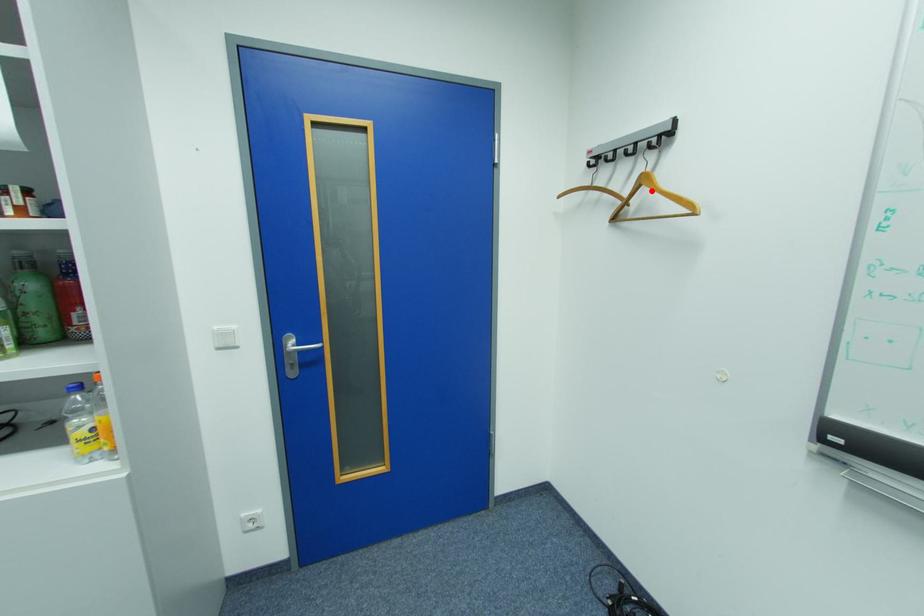
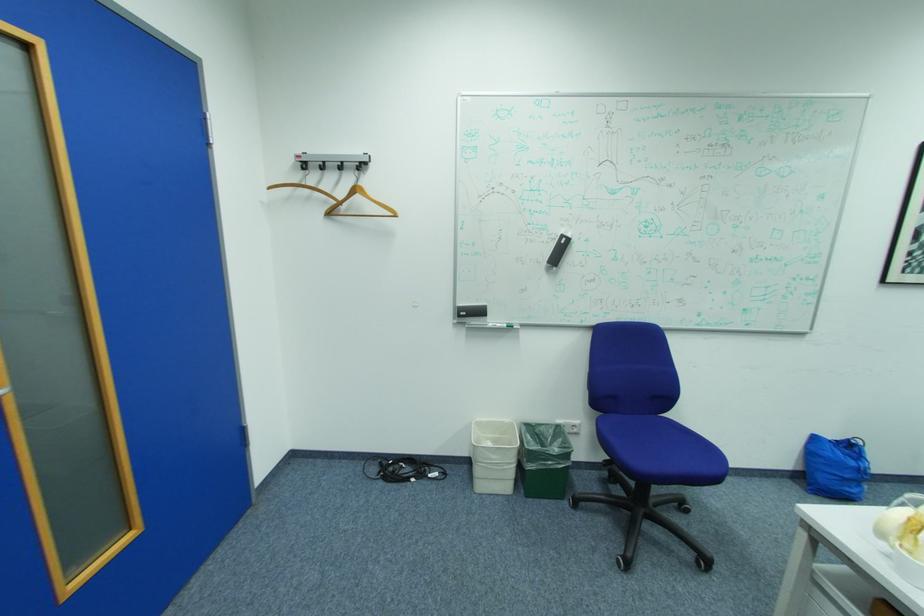
In the second image, find the point that corresponds to the highlighted location in the first image.

(366, 197)